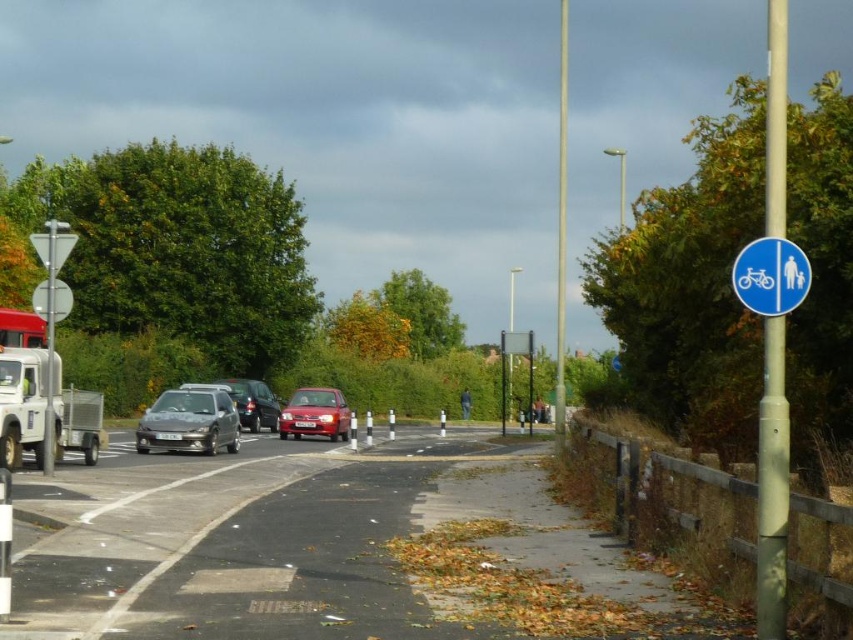
Based on the photo, does metallic gray hatchback at center appear on the left side of blue plastic sign at upper right?

Indeed, metallic gray hatchback at center is positioned on the left side of blue plastic sign at upper right.

Which is in front, point (206, 422) or point (762, 260)?

Positioned in front is point (762, 260).

Image resolution: width=853 pixels, height=640 pixels. Identify the location of metallic gray hatchback at center. (189, 422).

Does metallic gray hatchback at center appear on the right side of metallic silver car at center?

Indeed, metallic gray hatchback at center is positioned on the right side of metallic silver car at center.

Is metallic gray hatchback at center thinner than metallic silver car at center?

No.

Is point (148, 442) less distant than point (273, 412)?

That is True.

The height and width of the screenshot is (640, 853). Identify the location of metallic gray hatchback at center. (189, 422).

Between metallic gray hatchback at center and shiny red car at center, which one has more height?

shiny red car at center is taller.

Can you confirm if metallic gray hatchback at center is wider than shiny red car at center?

No.

Is point (171, 419) farther from viewer compared to point (305, 422)?

No, it is not.

Identify the location of metallic gray hatchback at center. This screenshot has width=853, height=640. click(x=189, y=422).